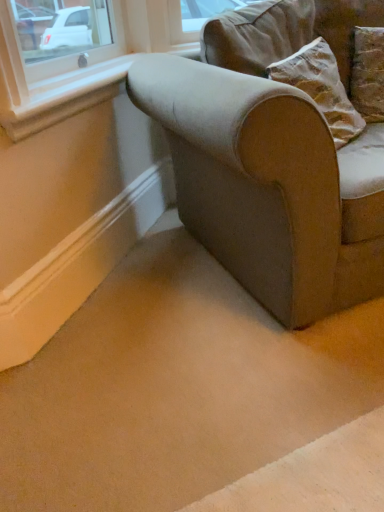
Where is `white smooth window sill at upper left`? The width and height of the screenshot is (384, 512). white smooth window sill at upper left is located at coordinates (61, 99).

What do you see at coordinates (61, 99) in the screenshot? I see `white smooth window sill at upper left` at bounding box center [61, 99].

In order to face velvet-like beige couch at center, should I rotate leftwards or rightwards?

It's best to rotate right around 20.593 degrees.

What do you see at coordinates (270, 186) in the screenshot? I see `velvet-like beige couch at center` at bounding box center [270, 186].

Where is `velvet-like beige couch at center`? This screenshot has height=512, width=384. velvet-like beige couch at center is located at coordinates (270, 186).

Measure the distance between velvet-like beige couch at center and camera.

They are 37.30 inches apart.

Where is `white smooth window sill at upper left`? This screenshot has height=512, width=384. white smooth window sill at upper left is located at coordinates (61, 99).

Considering the positions of objects white smooth window sill at upper left and velvet-like beige couch at center in the image provided, who is more to the right, white smooth window sill at upper left or velvet-like beige couch at center?

From the viewer's perspective, velvet-like beige couch at center appears more on the right side.

Is white smooth window sill at upper left in front of velvet-like beige couch at center?

No, white smooth window sill at upper left is further to the viewer.

Is point (39, 114) farther from camera compared to point (150, 73)?

No.

From the image's perspective, who appears lower, white smooth window sill at upper left or velvet-like beige couch at center?

velvet-like beige couch at center appears lower in the image.

From a real-world perspective, does white smooth window sill at upper left sit lower than velvet-like beige couch at center?

No, from a real-world perspective, white smooth window sill at upper left is not below velvet-like beige couch at center.

Is white smooth window sill at upper left wider or thinner than velvet-like beige couch at center?

In the image, white smooth window sill at upper left appears to be more narrow than velvet-like beige couch at center.

Who is taller, white smooth window sill at upper left or velvet-like beige couch at center?

With more height is velvet-like beige couch at center.

Can you confirm if white smooth window sill at upper left is smaller than velvet-like beige couch at center?

Yes, white smooth window sill at upper left is smaller than velvet-like beige couch at center.

Is white smooth window sill at upper left situated inside velvet-like beige couch at center or outside?

white smooth window sill at upper left is not inside velvet-like beige couch at center, it's outside.

In the scene shown: Is there a large distance between white smooth window sill at upper left and velvet-like beige couch at center?

They are positioned close to each other.

Is white smooth window sill at upper left positioned with its back to velvet-like beige couch at center?

white smooth window sill at upper left is not turned away from velvet-like beige couch at center.

Based on the photo, how different are the orientations of white smooth window sill at upper left and velvet-like beige couch at center in degrees?

45 degrees separate the facing orientations of white smooth window sill at upper left and velvet-like beige couch at center.

Find the location of a particular element. window sill that appears on the left of velvet-like beige couch at center is located at coordinates (61, 99).

Which object is positioned more to the left, velvet-like beige couch at center or white smooth window sill at upper left?

white smooth window sill at upper left.

Does velvet-like beige couch at center lie in front of white smooth window sill at upper left?

Yes, it is.

Which is in front, point (337, 234) or point (41, 126)?

The point (337, 234) is closer.

From the image's perspective, between velvet-like beige couch at center and white smooth window sill at upper left, which one is located above?

white smooth window sill at upper left, from the image's perspective.

From a real-world perspective, who is located lower, velvet-like beige couch at center or white smooth window sill at upper left?

velvet-like beige couch at center is physically lower.

Based on the photo, does velvet-like beige couch at center have a greater width compared to white smooth window sill at upper left?

Yes.

Is velvet-like beige couch at center shorter than white smooth window sill at upper left?

No, velvet-like beige couch at center is not shorter than white smooth window sill at upper left.

Is velvet-like beige couch at center bigger or smaller than white smooth window sill at upper left?

Considering their sizes, velvet-like beige couch at center takes up more space than white smooth window sill at upper left.

From the picture: Is velvet-like beige couch at center completely or partially outside of white smooth window sill at upper left?

Yes, velvet-like beige couch at center is not within white smooth window sill at upper left.

Are velvet-like beige couch at center and white smooth window sill at upper left located far from each other?

velvet-like beige couch at center is near white smooth window sill at upper left, not far away.

Is velvet-like beige couch at center oriented towards white smooth window sill at upper left?

No, velvet-like beige couch at center is not facing towards white smooth window sill at upper left.

The height and width of the screenshot is (512, 384). I want to click on window sill that appears behind the velvet-like beige couch at center, so click(61, 99).

Where is `studio couch in front of the white smooth window sill at upper left`? Image resolution: width=384 pixels, height=512 pixels. studio couch in front of the white smooth window sill at upper left is located at coordinates (270, 186).

I want to click on studio couch below the white smooth window sill at upper left (from the image's perspective), so click(x=270, y=186).